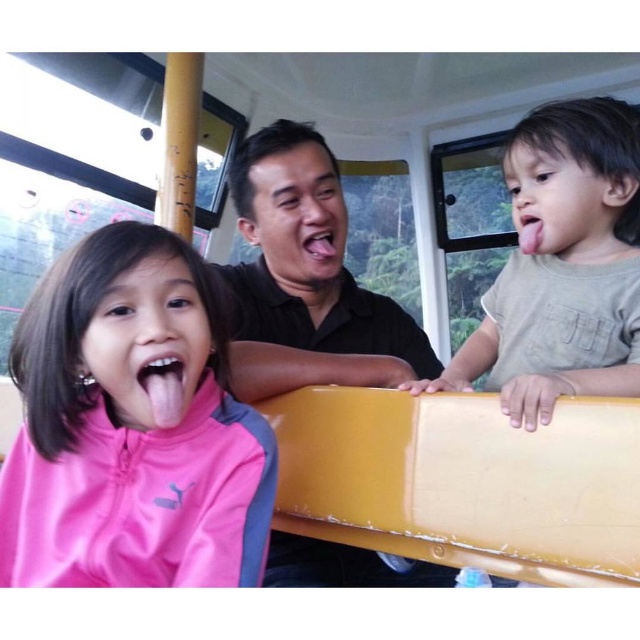
You are a photographer inside the cable car and want to capture both the pink matte tongue at center and the pink matte tongue at right in a single photo. Which tongue should you focus on first if you want to ensure both are in frame?

The pink matte tongue at center has a lesser height compared to pink matte tongue at right, so you should focus on the pink matte tongue at right first to ensure both fit within the frame.

You are a photographer trying to capture both the black matte shirt at center and the pink matte tongue at right in a single frame. Which object should you focus on first to ensure both are in the frame?

The black matte shirt at center is larger in size than the pink matte tongue at right, so you should focus on the black matte shirt at center first to ensure both are in the frame.

You are a photographer inside the cable car and want to take a photo of both the black matte shirt at center and the pink matte tongue at right. Which object is located more to the left side?

The black matte shirt at center is positioned on the left side of pink matte tongue at right, so the black matte shirt at center is more to the left.